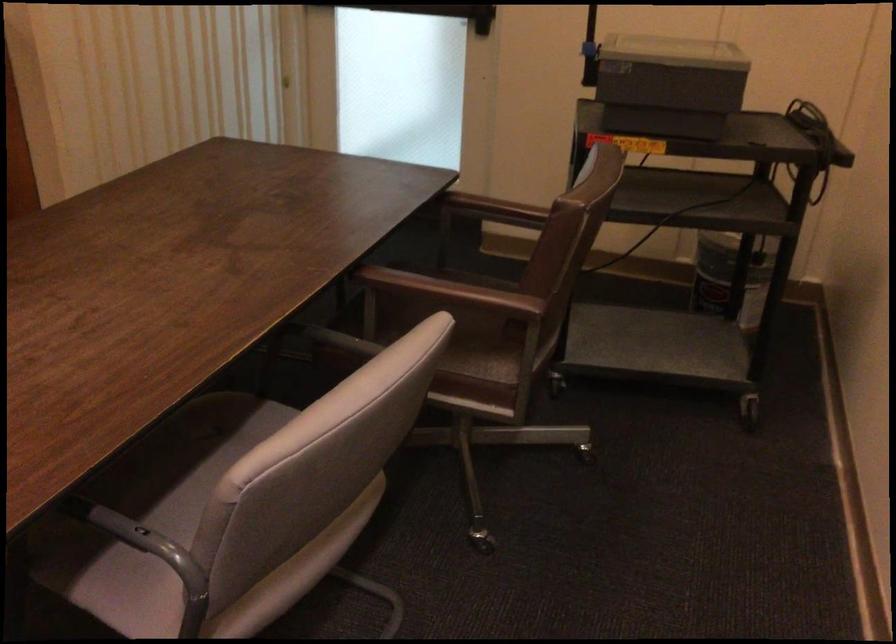
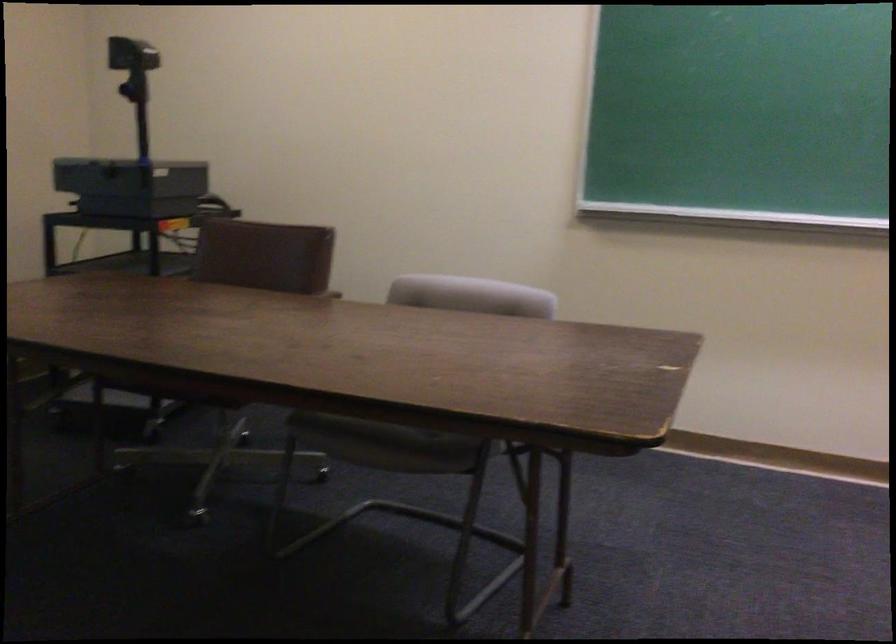
Question: I am providing you with two images of the same scene from different viewpoints. After the viewpoint changes to image2, which objects are now occluded?

Choices:
 (A) projector head
 (B) polka dot mug
 (C) black overhead projector
 (D) grey chair armrest

Answer: (D)